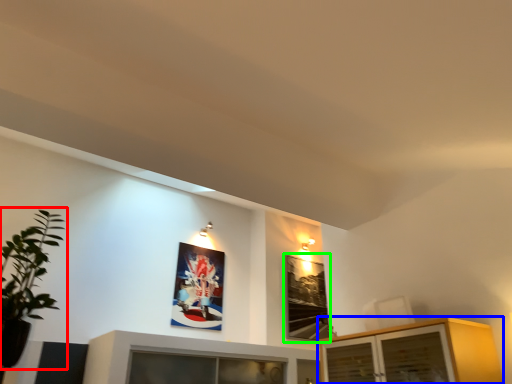
Question: Which object is positioned farthest from houseplant (highlighted by a red box)? Select from cabinetry (highlighted by a blue box) and picture frame (highlighted by a green box).

Choices:
 (A) cabinetry
 (B) picture frame

Answer: (B)